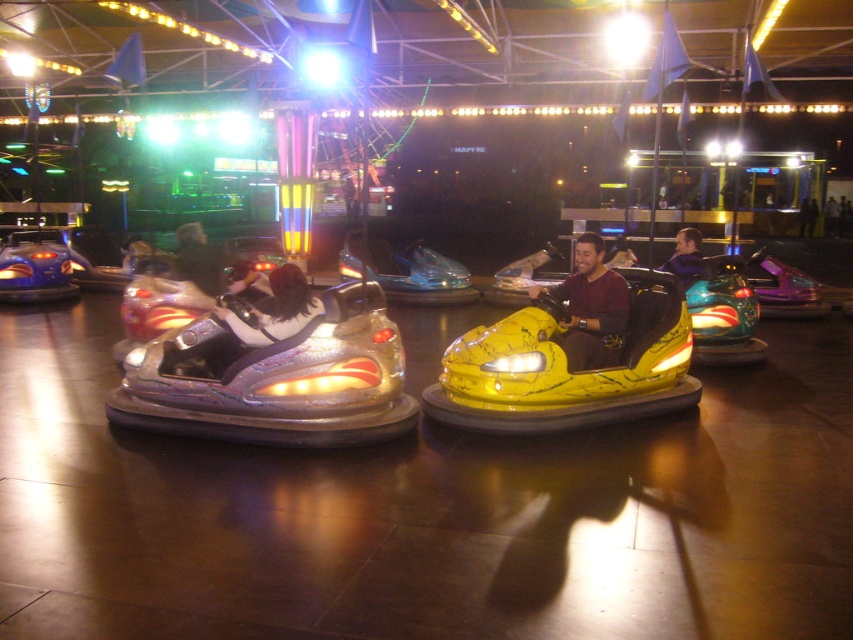
Can you confirm if maroon jersey at center is positioned to the left of purple matte jacket at center?

Correct, you'll find maroon jersey at center to the left of purple matte jacket at center.

Can you confirm if maroon jersey at center is positioned to the right of purple matte jacket at center?

No, maroon jersey at center is not to the right of purple matte jacket at center.

Between point (598, 362) and point (686, 227), which one is positioned in front?

Point (598, 362) is in front.

Where is `maroon jersey at center`? This screenshot has height=640, width=853. maroon jersey at center is located at coordinates (590, 307).

Based on the photo, who is more forward, (196, 262) or (691, 236)?

Positioned in front is point (196, 262).

This screenshot has width=853, height=640. Identify the location of shiny silver helmet at center. (206, 260).

Which of these two, shiny silver bumper car at left or shiny silver helmet at center, stands taller?

Standing taller between the two is shiny silver helmet at center.

Does shiny silver bumper car at left appear under shiny silver helmet at center?

Yes.

Locate an element on the screen. shiny silver bumper car at left is located at coordinates (242, 326).